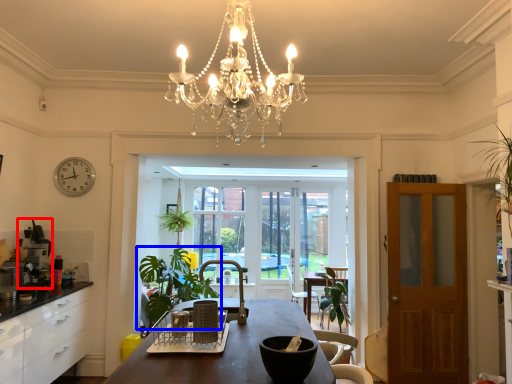
Question: Which point is closer to the camera, coffee machine (highlighted by a red box) or houseplant (highlighted by a blue box)?

Choices:
 (A) coffee machine
 (B) houseplant

Answer: (A)